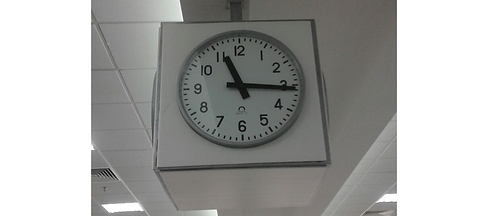
I want to click on light, so (x=122, y=208).